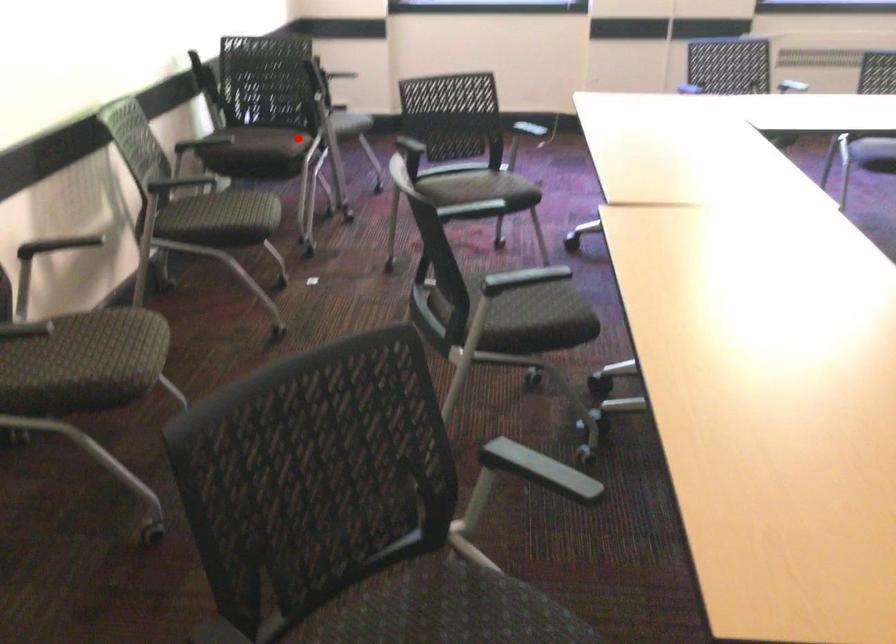
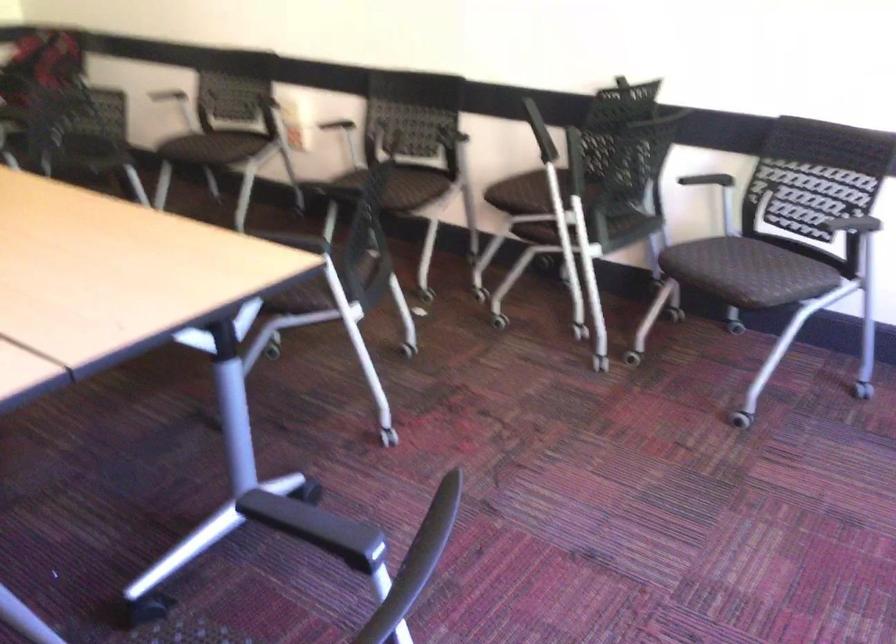
Question: I am providing you with two images of the same scene from different viewpoints. Given a red point in image1, look at the same physical point in image2. Is it:

Choices:
 (A) Closer to the viewpoint
 (B) Farther from the viewpoint

Answer: (A)